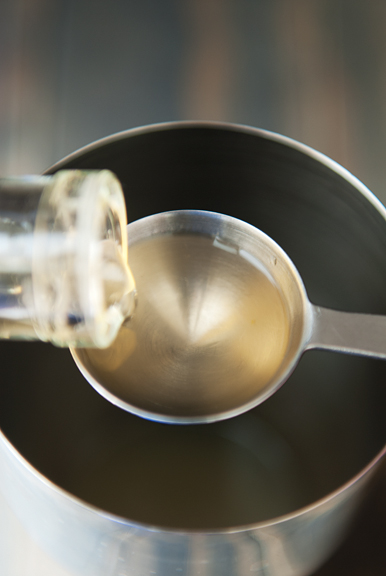
You are a GUI agent. You are given a task and a screenshot of the screen. Output one action in this format:
    pyautogui.click(x=<x>, y=<y>)
    Task: Click on the pot
    This screenshot has height=576, width=386.
    Given the screenshot: What is the action you would take?
    pyautogui.click(x=64, y=533)